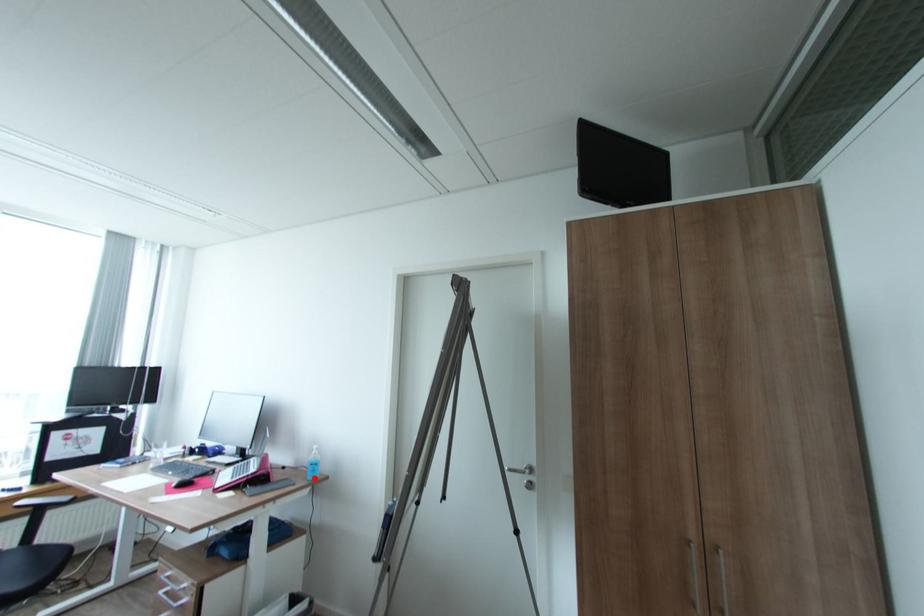
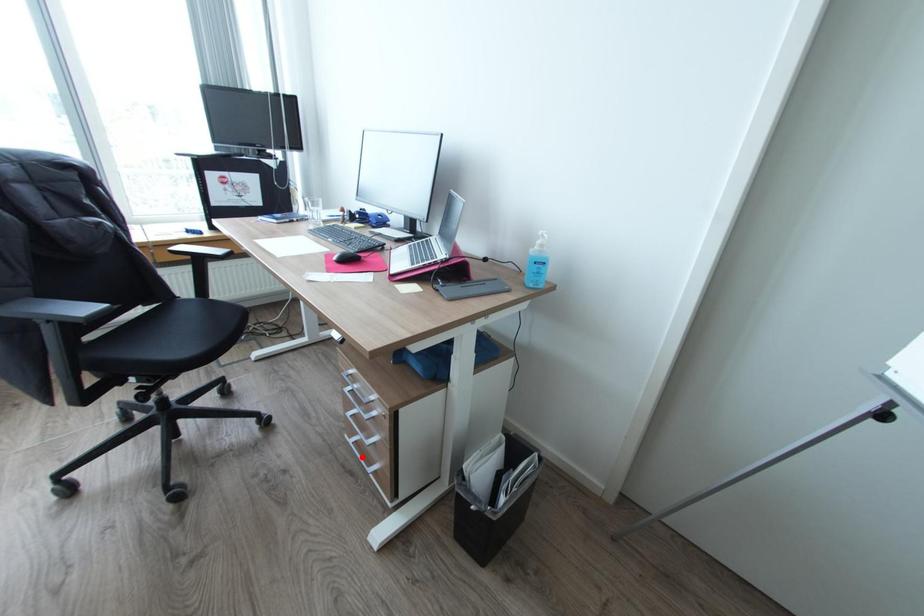
I am providing you with two images of the same scene from different viewpoints. A red point is marked on the first image and another point is marked on the second image. Is the red point in image1 aligned with the point shown in image2?

No